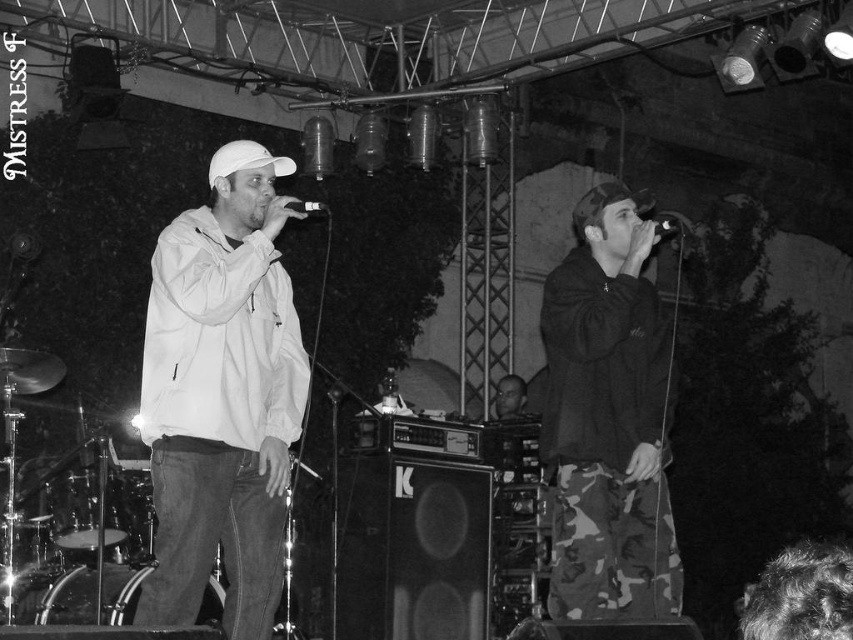
Question: Can you confirm if white matte jacket at left is positioned below smooth skin head at center?

Choices:
 (A) yes
 (B) no

Answer: (B)

Question: From the image, what is the correct spatial relationship of smooth skin head at center in relation to metallic black microphone at center?

Choices:
 (A) right
 (B) left

Answer: (A)

Question: Based on their relative distances, which object is nearer to the smooth skin head at center?

Choices:
 (A) white matte jacket at left
 (B) metallic silver microphone at center
 (C) metallic black microphone at center

Answer: (B)

Question: Among these points, which one is nearest to the camera?

Choices:
 (A) (277, 337)
 (B) (647, 316)
 (C) (654, 230)

Answer: (A)

Question: Is smooth skin head at center positioned at the back of metallic silver microphone at center?

Choices:
 (A) yes
 (B) no

Answer: (A)

Question: Which point appears farthest from the camera in this image?

Choices:
 (A) (653, 234)
 (B) (497, 401)

Answer: (B)